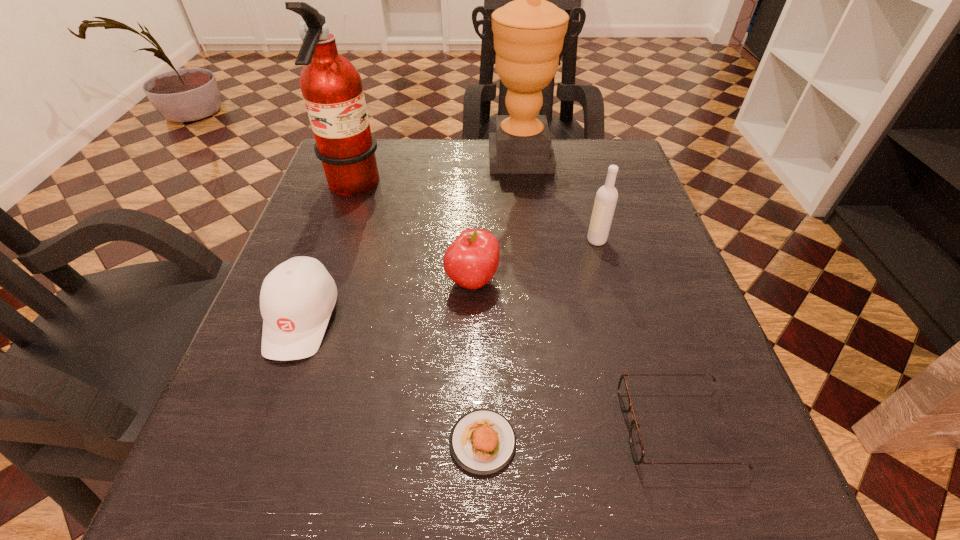
What are the coordinates of `vacant position at the left edge of the desktop` in the screenshot? It's located at (328, 256).

You are a GUI agent. You are given a task and a screenshot of the screen. Output one action in this format:
    pyautogui.click(x=<x>, y=<y>)
    Task: Click on the free location at the right edge of the desktop
    
    Given the screenshot: What is the action you would take?
    pyautogui.click(x=713, y=360)

Locate an element on the screen. vacant space at the near left corner of the desktop is located at coordinates (233, 506).

What are the coordinates of `vacant region at the far right corner of the desktop` in the screenshot? It's located at (612, 144).

Image resolution: width=960 pixels, height=540 pixels. In order to click on vacant space at the near right corner of the desktop in this screenshot , I will do `click(742, 511)`.

I want to click on empty location between the apple and the fire extinguisher, so click(x=412, y=234).

You are a GUI agent. You are given a task and a screenshot of the screen. Output one action in this format:
    pyautogui.click(x=<x>, y=<y>)
    Task: Click on the unoccupied position between the fire extinguisher and the sunglasses
    The height and width of the screenshot is (540, 960).
    Given the screenshot: What is the action you would take?
    tap(515, 307)

The width and height of the screenshot is (960, 540). I want to click on free spot between the vodka and the award, so click(x=558, y=198).

Image resolution: width=960 pixels, height=540 pixels. I want to click on blank region between the fire extinguisher and the apple, so click(x=412, y=234).

Where is `free spot between the award and the shortest object`? free spot between the award and the shortest object is located at coordinates (501, 299).